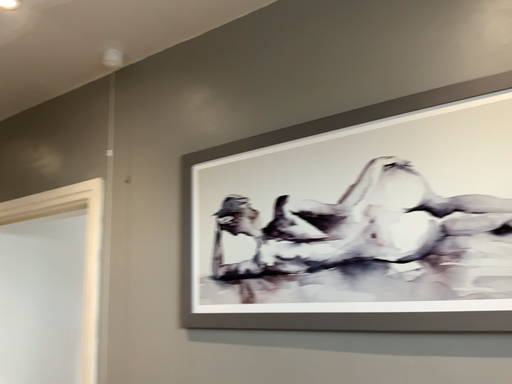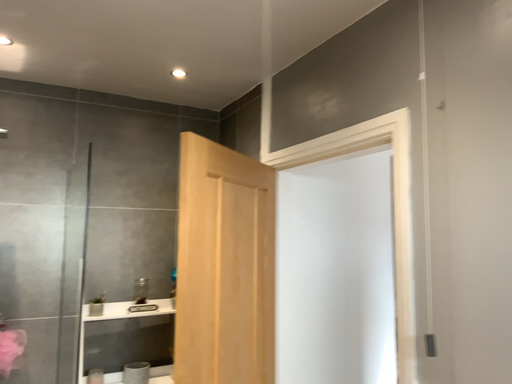
Question: Which way did the camera rotate in the video?

Choices:
 (A) rotated right
 (B) rotated left

Answer: (B)